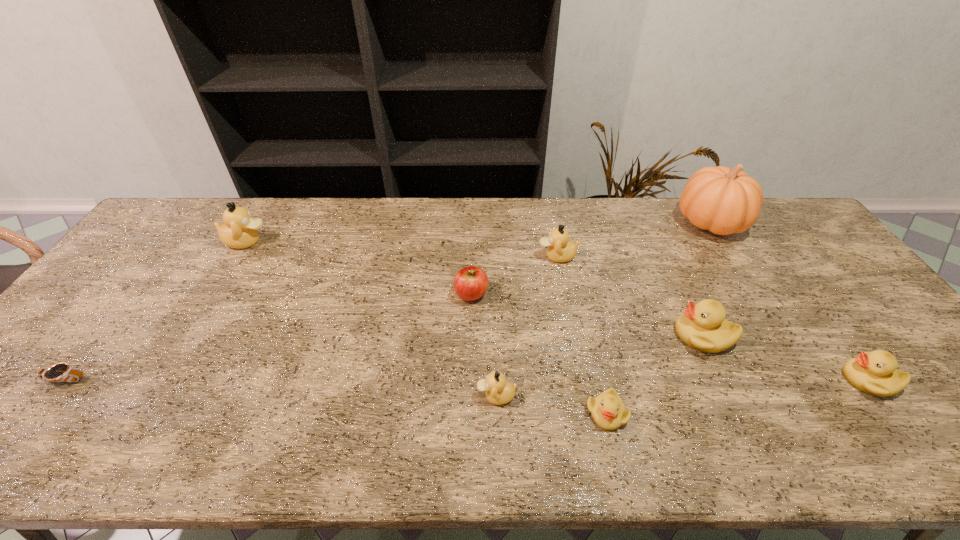
This screenshot has height=540, width=960. I want to click on orange pumpkin, so click(724, 201).

In order to click on pumpkin in this screenshot , I will do `click(724, 201)`.

Identify the location of the leftmost tan duckling. (240, 230).

Where is `the biggest tan duckling`? The width and height of the screenshot is (960, 540). the biggest tan duckling is located at coordinates (240, 230).

Locate an element on the screen. The width and height of the screenshot is (960, 540). the second smallest tan duckling is located at coordinates (560, 249).

Locate an element on the screen. the third object from right to left is located at coordinates (702, 326).

You are a GUI agent. You are given a task and a screenshot of the screen. Output one action in this format:
    pyautogui.click(x=<x>, y=<y>)
    Task: Click on the second yellow duckling from right to left
    This screenshot has height=540, width=960.
    Given the screenshot: What is the action you would take?
    pyautogui.click(x=702, y=326)

You are a GUI agent. You are given a task and a screenshot of the screen. Output one action in this format:
    pyautogui.click(x=<x>, y=<y>)
    Task: Click on the fourth farthest object
    Image resolution: width=960 pixels, height=540 pixels.
    Given the screenshot: What is the action you would take?
    pyautogui.click(x=470, y=283)

Find the location of a particular element. The width and height of the screenshot is (960, 540). apple is located at coordinates (470, 283).

You are a GUI agent. You are given a task and a screenshot of the screen. Output one action in this format:
    pyautogui.click(x=<x>, y=<y>)
    Task: Click on the rightmost duckling
    
    Given the screenshot: What is the action you would take?
    click(875, 373)